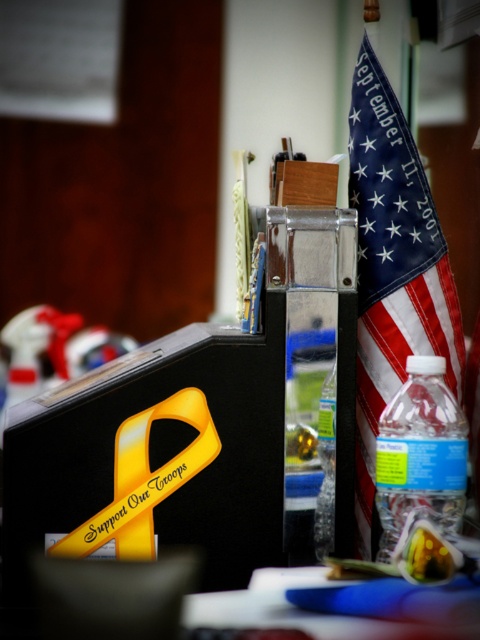
Question: Which is nearer to the blue plastic folder at lower center?

Choices:
 (A) blue fabric flag at right
 (B) clear plastic bottle at right
 (C) clear plastic bottle at center-right

Answer: (B)

Question: Based on their relative distances, which object is nearer to the clear plastic bottle at center-right?

Choices:
 (A) clear plastic bottle at right
 (B) blue plastic folder at lower center
 (C) blue fabric flag at right

Answer: (A)

Question: Can you confirm if blue plastic folder at lower center is thinner than clear plastic bottle at center-right?

Choices:
 (A) yes
 (B) no

Answer: (B)

Question: Considering the relative positions of clear plastic bottle at right and blue plastic folder at lower center in the image provided, where is clear plastic bottle at right located with respect to blue plastic folder at lower center?

Choices:
 (A) left
 (B) right

Answer: (B)

Question: Can you confirm if blue fabric flag at right is wider than blue plastic folder at lower center?

Choices:
 (A) no
 (B) yes

Answer: (A)

Question: Which point is farther from the camera taking this photo?

Choices:
 (A) (324, 484)
 (B) (372, 148)

Answer: (B)